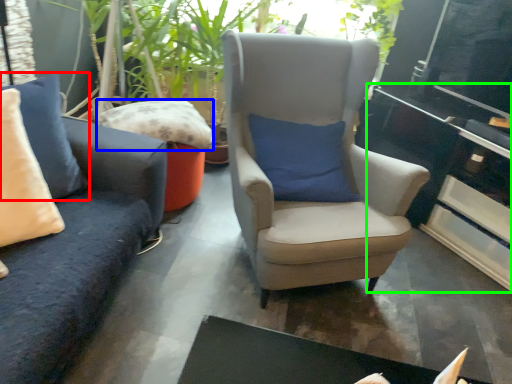
Question: Which object is the farthest from pillow (highlighted by a red box)? Choose among these: pillow (highlighted by a blue box) or table (highlighted by a green box).

Choices:
 (A) pillow
 (B) table

Answer: (B)